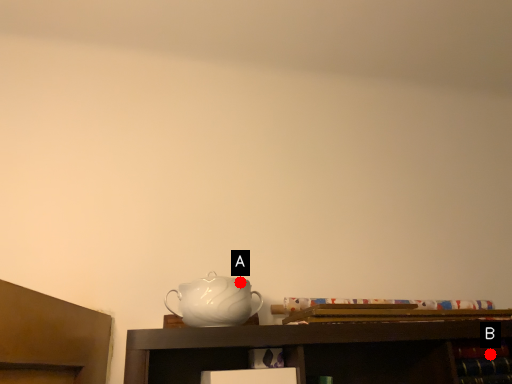
Question: Two points are circled on the image, labeled by A and B beside each circle. Which point appears closest to the camera in this image?

Choices:
 (A) A is closer
 (B) B is closer

Answer: (A)